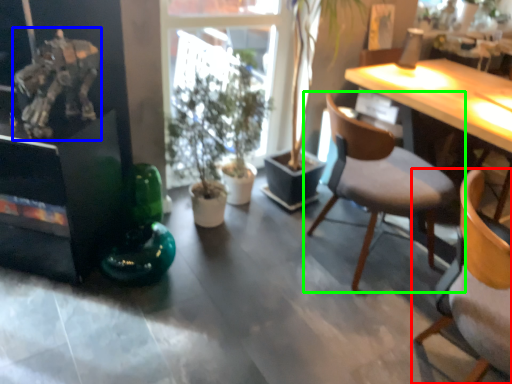
Question: Considering the real-world distances, which object is farthest from chair (highlighted by a red box)? art (highlighted by a blue box) or chair (highlighted by a green box)?

Choices:
 (A) art
 (B) chair

Answer: (A)